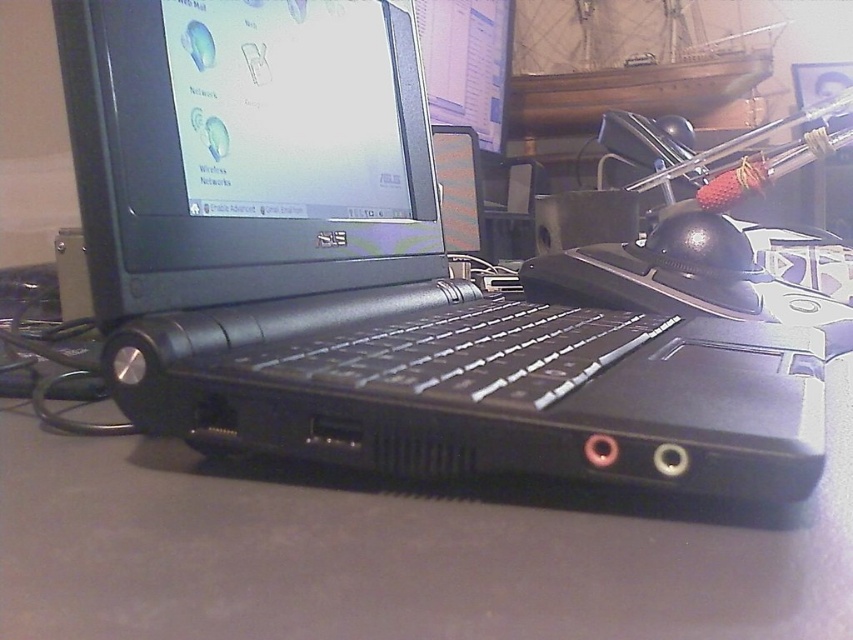
Question: Among these points, which one is nearest to the camera?

Choices:
 (A) (190, 188)
 (B) (416, 371)

Answer: (B)

Question: Which object appears closest to the camera in this image?

Choices:
 (A) black matte keyboard at center
 (B) black plastic laptop at center

Answer: (B)

Question: Is black plastic laptop at center smaller than black matte keyboard at center?

Choices:
 (A) no
 (B) yes

Answer: (A)

Question: Which of the following is the closest to the observer?

Choices:
 (A) black matte keyboard at center
 (B) black plastic laptop at center

Answer: (B)

Question: Does black plastic laptop at center have a lesser width compared to black matte keyboard at center?

Choices:
 (A) yes
 (B) no

Answer: (B)

Question: From the image, what is the correct spatial relationship of black plastic laptop at center in relation to black matte keyboard at center?

Choices:
 (A) above
 (B) below

Answer: (A)